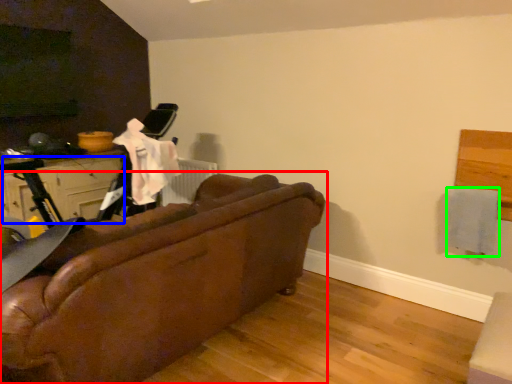
Question: Estimate the real-world distances between objects in this image. Which object is closer to studio couch (highlighted by a red box), drawer (highlighted by a blue box) or clothe (highlighted by a green box)?

Choices:
 (A) drawer
 (B) clothe

Answer: (B)